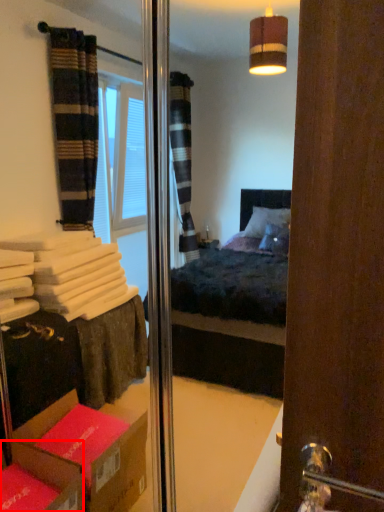
Question: Where is cardboard box (annotated by the red box) located in relation to door handle in the image?

Choices:
 (A) left
 (B) right

Answer: (A)